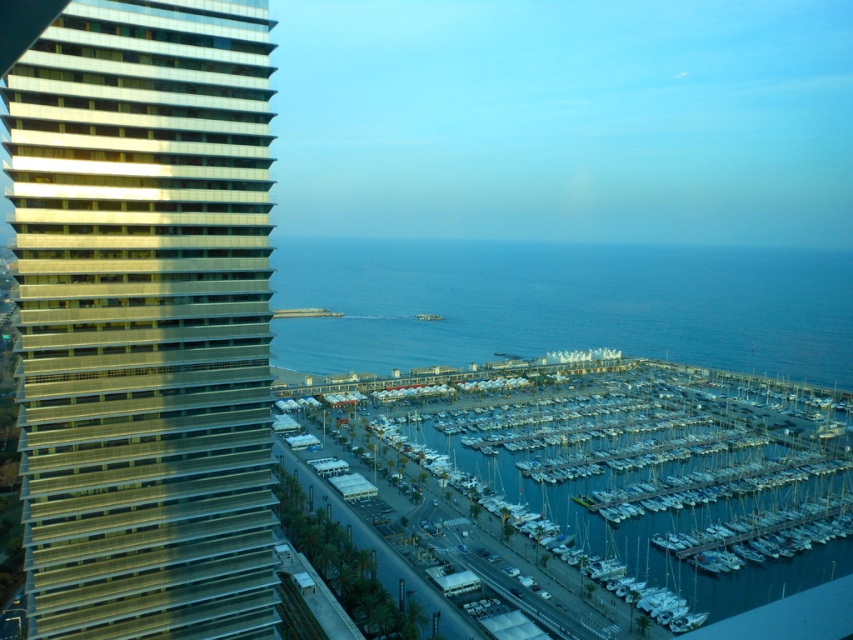
Can you confirm if white matte boats at center is positioned above blue water at lower center?

No, white matte boats at center is not above blue water at lower center.

Does white matte boats at center have a smaller size compared to blue water at lower center?

Yes.

At what (x,y) coordinates should I click in order to perform the action: click on white matte boats at center. Please return your answer as a coordinate pair (x, y). The width and height of the screenshot is (853, 640). Looking at the image, I should click on (645, 470).

What do you see at coordinates (144, 317) in the screenshot? I see `metallic glass building at left` at bounding box center [144, 317].

Is metallic glass building at left bigger than white matte boats at center?

No.

This screenshot has width=853, height=640. What do you see at coordinates (144, 317) in the screenshot?
I see `metallic glass building at left` at bounding box center [144, 317].

At what (x,y) coordinates should I click in order to perform the action: click on metallic glass building at left. Please return your answer as a coordinate pair (x, y). The image size is (853, 640). Looking at the image, I should click on (144, 317).

Is metallic glass building at left positioned before blue water at lower center?

Yes, metallic glass building at left is closer to the viewer.

Where is `metallic glass building at left`? This screenshot has width=853, height=640. metallic glass building at left is located at coordinates (144, 317).

You are a GUI agent. You are given a task and a screenshot of the screen. Output one action in this format:
    pyautogui.click(x=<x>, y=<y>)
    Task: Click on the metallic glass building at left
    
    Given the screenshot: What is the action you would take?
    pyautogui.click(x=144, y=317)